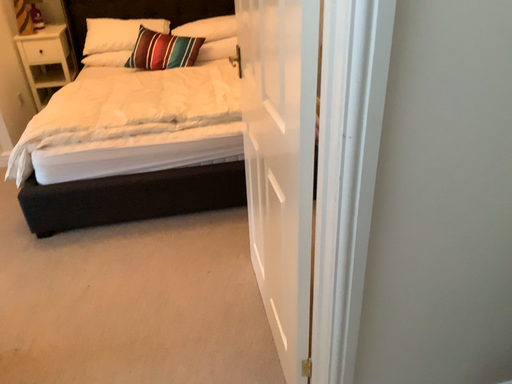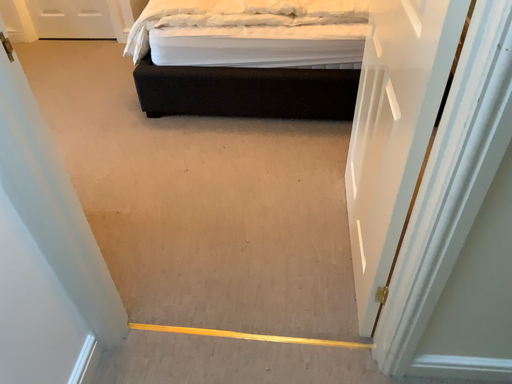
Question: How did the camera likely rotate when shooting the video?

Choices:
 (A) rotated right
 (B) rotated left

Answer: (B)